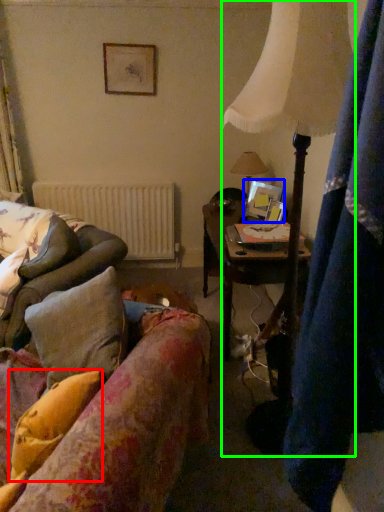
Question: Which object is positioned closest to pillow (highlighted by a red box)? Select from picture frame (highlighted by a blue box) and lamp (highlighted by a green box).

Choices:
 (A) picture frame
 (B) lamp

Answer: (B)